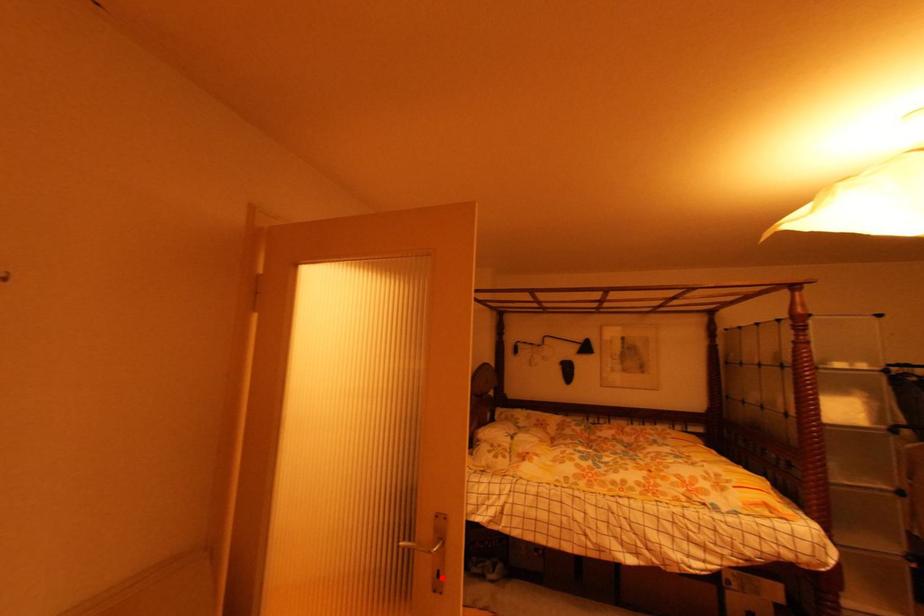
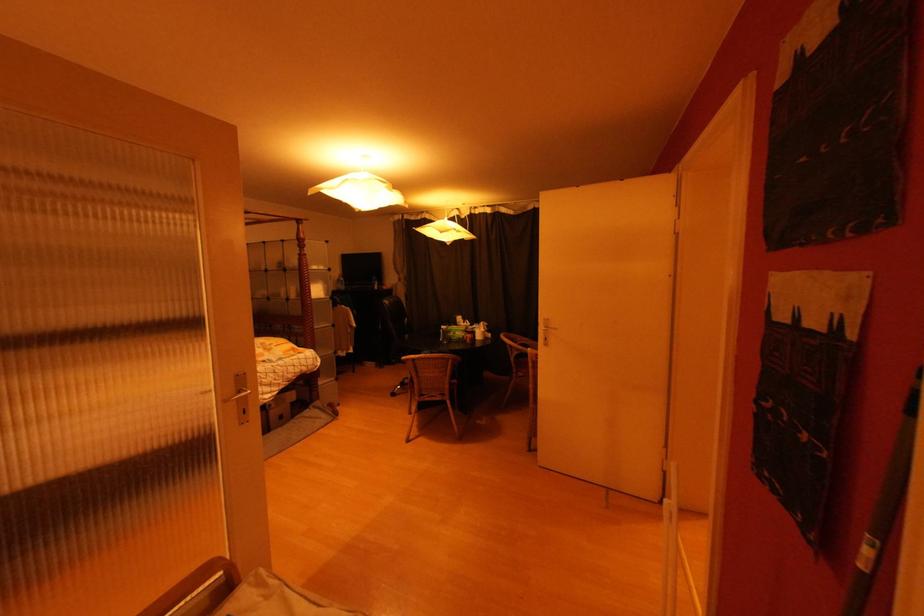
Question: A red point is marked in image1. In image2, is the corresponding 3D point closer to the camera or farther? Reply with the corresponding letter.

Choices:
 (A) The corresponding 3D point is closer.
 (B) The corresponding 3D point is farther.

Answer: (A)